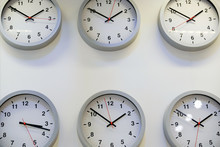
This screenshot has height=147, width=220. I want to click on glass, so click(x=191, y=30), click(x=116, y=129), click(x=186, y=132), click(x=16, y=131), click(x=28, y=25), click(x=113, y=24).